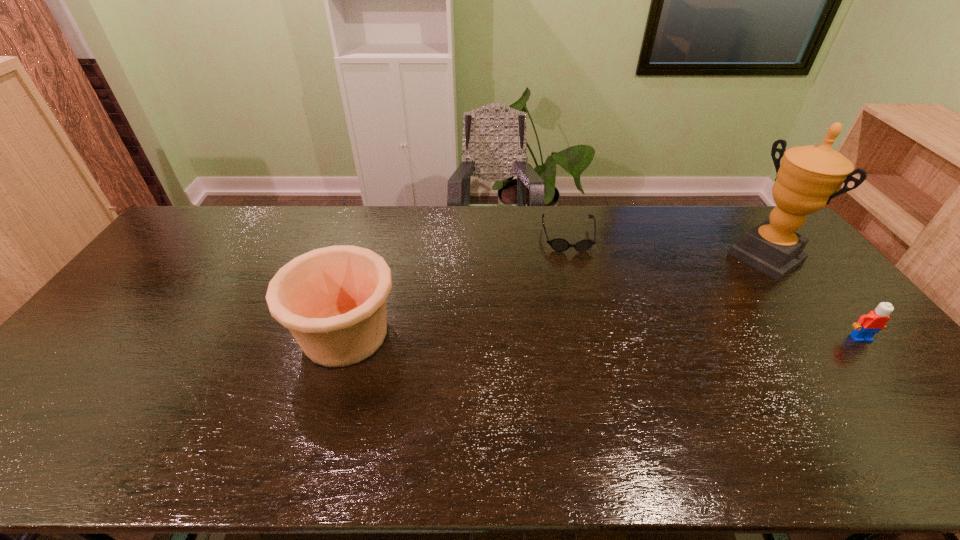
Locate an element on the screen. the leftmost object is located at coordinates (333, 300).

In order to click on pottery in this screenshot , I will do `click(333, 300)`.

At what (x,y) coordinates should I click in order to perform the action: click on the second shortest object. Please return your answer as a coordinate pair (x, y). Image resolution: width=960 pixels, height=540 pixels. Looking at the image, I should click on (868, 325).

The image size is (960, 540). Identify the location of award. (809, 177).

Locate an element on the screen. This screenshot has height=540, width=960. the shortest object is located at coordinates (558, 244).

Where is `the third object from right to left`? This screenshot has height=540, width=960. the third object from right to left is located at coordinates (558, 244).

I want to click on vacant area located on the left of the leftmost object, so pyautogui.click(x=273, y=334).

Where is `vacant area situated on the face of the Lego`? vacant area situated on the face of the Lego is located at coordinates (918, 407).

This screenshot has width=960, height=540. Identify the location of free point located 0.180m at the front of the award with handles. coord(713,294).

Find the location of a particular element. This screenshot has height=540, width=960. free space located 0.370m at the front of the award with handles is located at coordinates (675, 321).